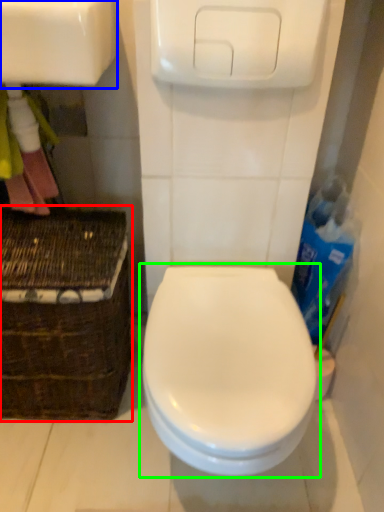
Question: Which object is the closest to the basket (highlighted by a red box)? Choose among these: sink (highlighted by a blue box) or toilet (highlighted by a green box).

Choices:
 (A) sink
 (B) toilet

Answer: (B)